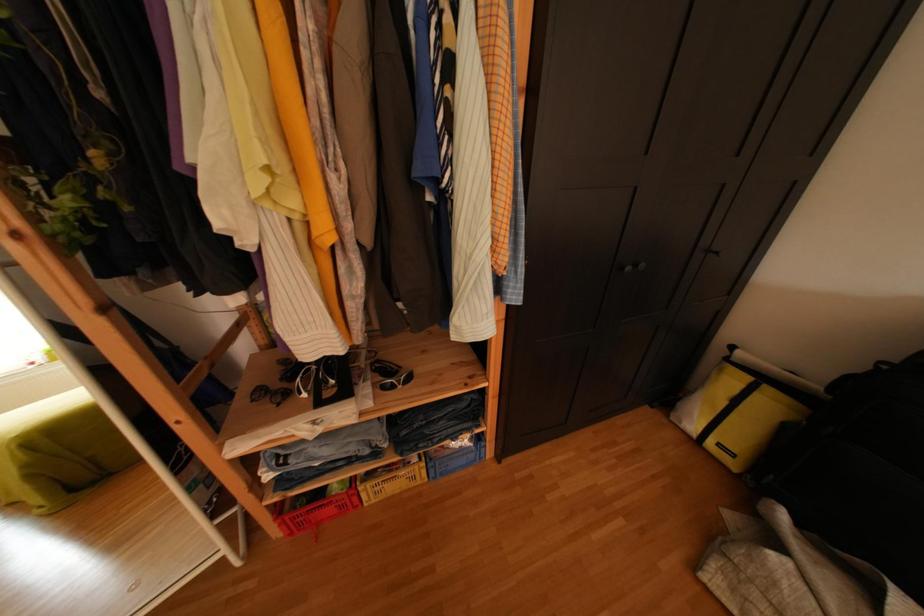
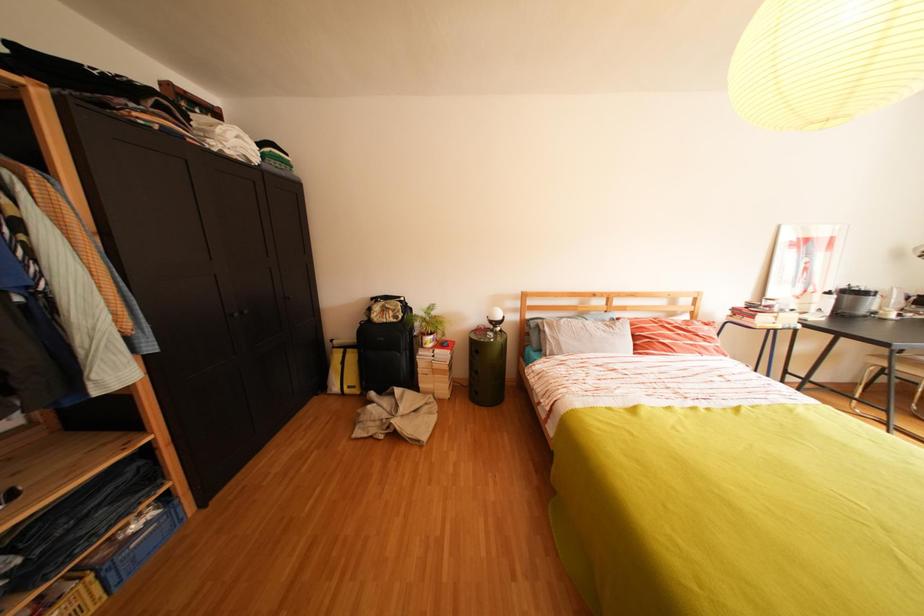
Question: How did the camera likely rotate?

Choices:
 (A) Left
 (B) Right
 (C) Up
 (D) Down

Answer: (B)